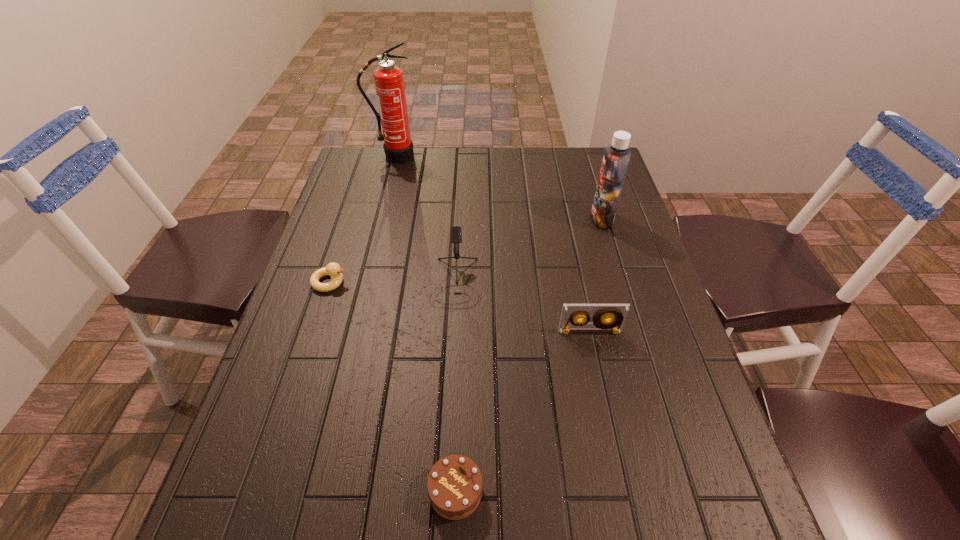
Find the location of a particular element. Image resolution: width=960 pixels, height=540 pixels. the farthest object is located at coordinates (x=389, y=83).

What are the coordinates of `fire extinguisher` in the screenshot? It's located at (389, 83).

You are a GUI agent. You are given a task and a screenshot of the screen. Output one action in this format:
    pyautogui.click(x=<x>, y=<y>)
    Task: Click on the second tallest object
    This screenshot has height=540, width=960.
    Given the screenshot: What is the action you would take?
    pyautogui.click(x=616, y=158)

The image size is (960, 540). Find the location of `shampoo`. shampoo is located at coordinates (616, 158).

The width and height of the screenshot is (960, 540). Identify the location of microphone. (456, 234).

At what (x,y) coordinates should I click in order to perform the action: click on the second object from right to left. Please return your answer as a coordinate pair (x, y). Looking at the image, I should click on (616, 313).

At what (x,y) coordinates should I click in order to perform the action: click on videotape. Please return your answer as a coordinate pair (x, y). The image size is (960, 540). Looking at the image, I should click on (616, 313).

Find the location of a particular element. The height and width of the screenshot is (540, 960). the nearest object is located at coordinates (454, 485).

Where is `duckling`? Image resolution: width=960 pixels, height=540 pixels. duckling is located at coordinates (332, 269).

This screenshot has height=540, width=960. Find the location of `free location located on the front-facing side of the tallest object`. free location located on the front-facing side of the tallest object is located at coordinates (390, 174).